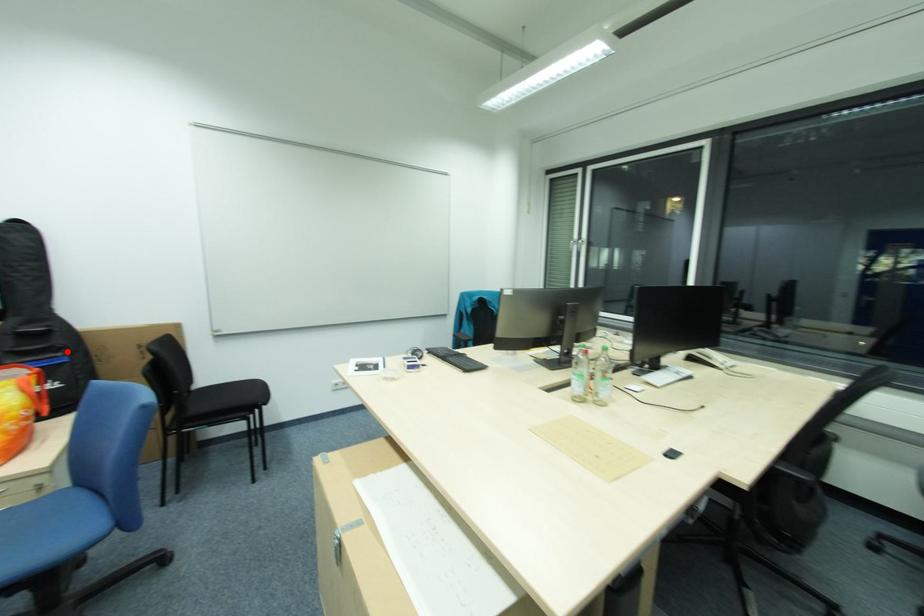
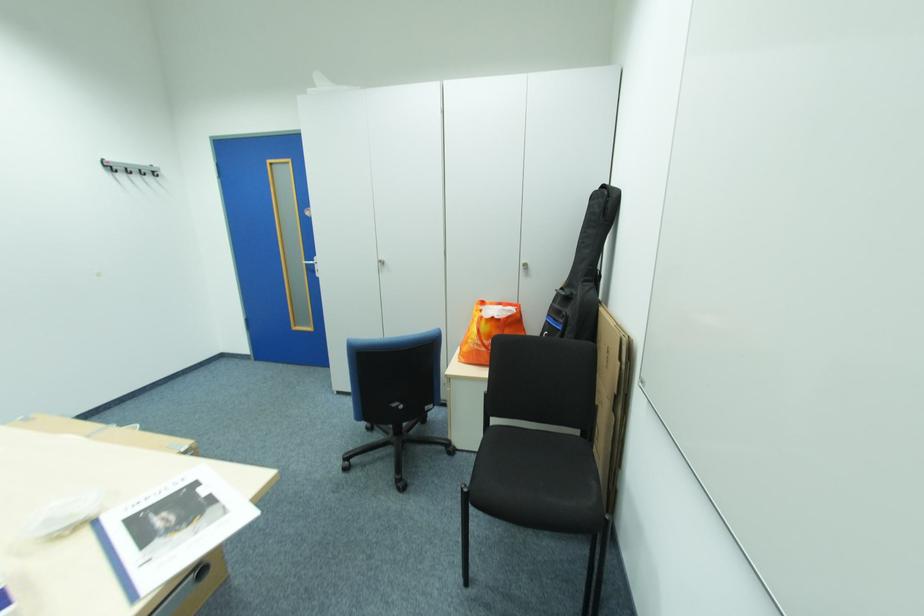
Where in the second image is the point corresponding to the highlighted location from the first image?

(572, 318)